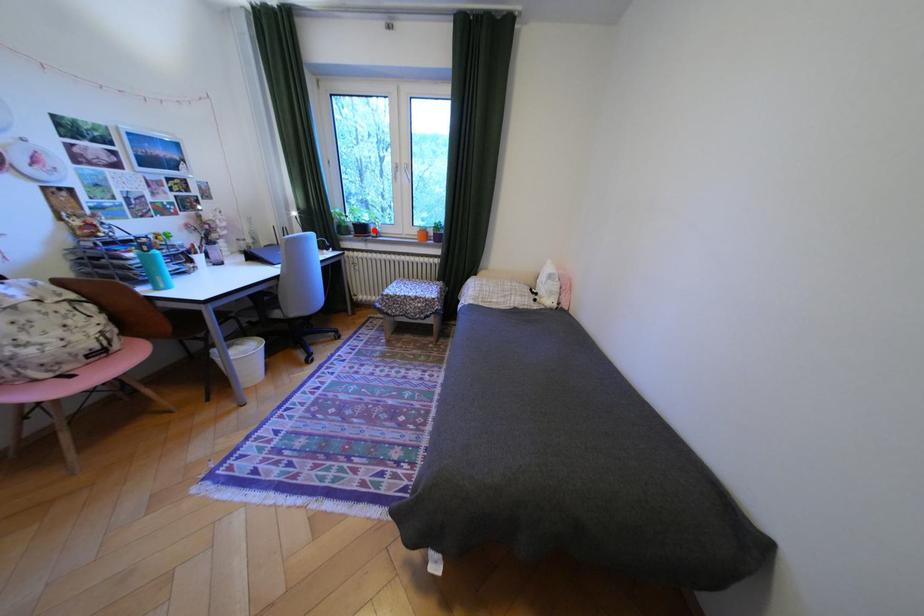
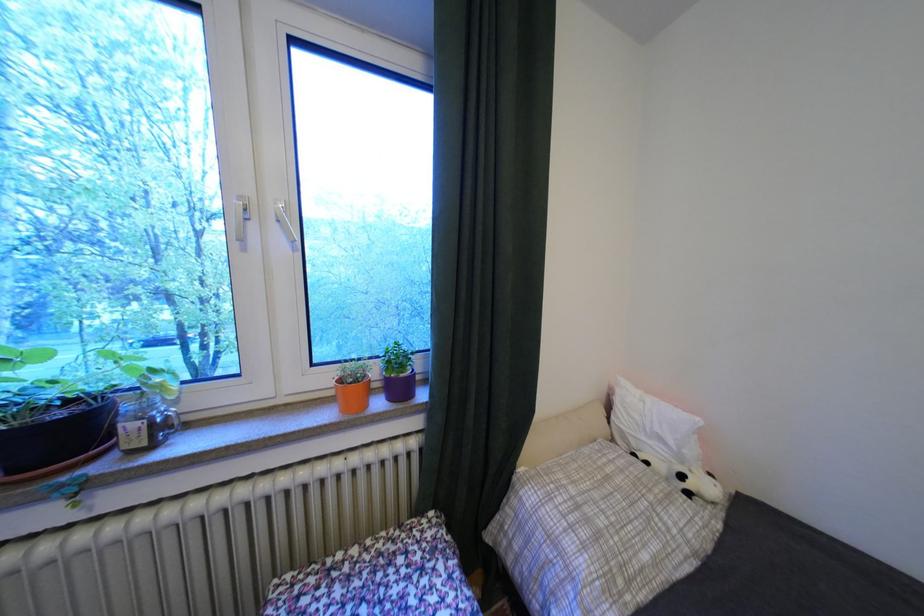
Locate, in the second image, the point that corresponds to the highlighted location in the first image.

(75, 436)